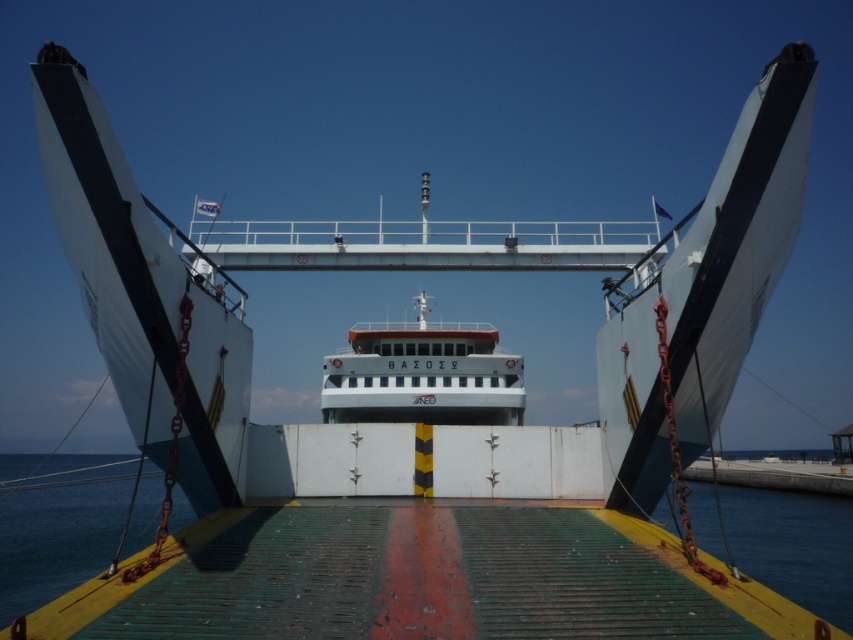
Can you confirm if white matte ship at center is wider than blue water at lower left?

Incorrect, white matte ship at center's width does not surpass blue water at lower left's.

Between white matte ship at center and blue water at lower left, which one appears on the right side from the viewer's perspective?

Positioned to the right is white matte ship at center.

Is point (357, 403) closer to camera compared to point (30, 600)?

No, it is behind (30, 600).

Where is `white matte ship at center`? white matte ship at center is located at coordinates (422, 374).